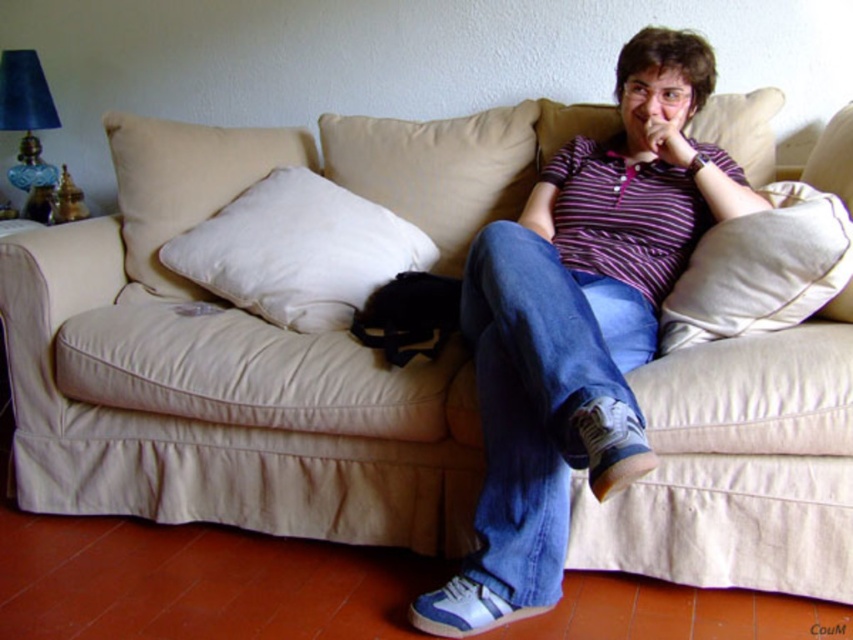
Can you confirm if white soft pillow at center is positioned above matte purple shirt at upper center?

No, white soft pillow at center is not above matte purple shirt at upper center.

Who is taller, white soft pillow at center or matte purple shirt at upper center?

Result: white soft pillow at center

Is point (210, 244) positioned behind point (666, 134)?

Yes.

This screenshot has height=640, width=853. Find the location of `white soft pillow at center`. white soft pillow at center is located at coordinates (299, 252).

Can you confirm if beige fabric pillow at center is positioned to the left of white fabric pillow at center?

Yes, beige fabric pillow at center is to the left of white fabric pillow at center.

Who is positioned more to the left, beige fabric pillow at center or white fabric pillow at center?

From the viewer's perspective, beige fabric pillow at center appears more on the left side.

Who is more distant from viewer, (509, 124) or (550, 113)?

The point (509, 124) is behind.

Identify the location of beige fabric pillow at center. pos(437,170).

Looking at this image, can you confirm if white soft pillow at center is wider than beige fabric pillow at center?

Indeed, white soft pillow at center has a greater width compared to beige fabric pillow at center.

Can you confirm if white soft pillow at center is bigger than beige fabric pillow at center?

Yes.

The height and width of the screenshot is (640, 853). Find the location of `white soft pillow at center`. white soft pillow at center is located at coordinates (299, 252).

The image size is (853, 640). I want to click on white soft pillow at center, so click(x=299, y=252).